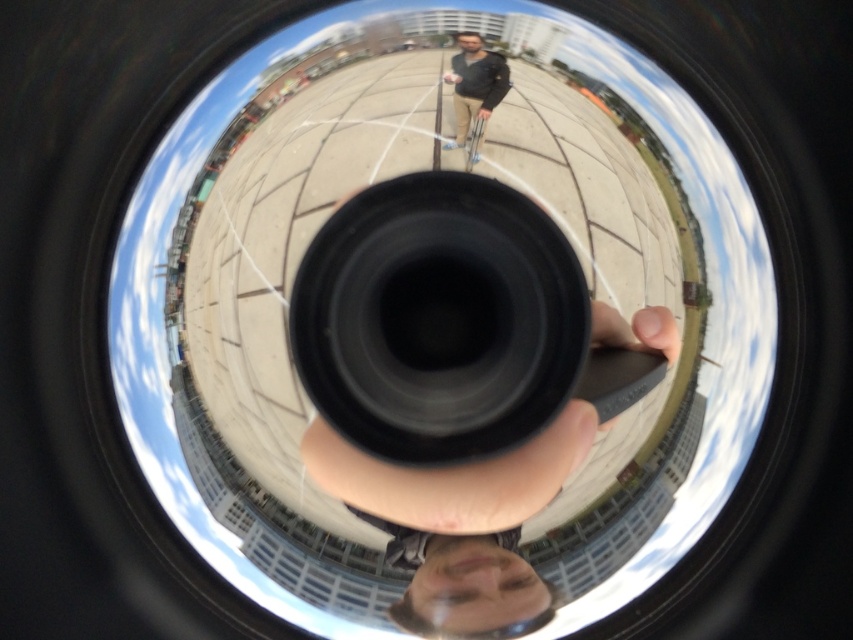
You are a photographer trying to capture a closeup of the black matte hand at center and the dark gray jacket at center in the fisheye lens image. Based on their sizes, which object should you focus on first to ensure it appears sharp in the final photo?

The black matte hand at center has a larger width than the dark gray jacket at center, so you should focus on the black matte hand at center first to ensure it appears sharp in the final photo.

Based on the scene described, which object, the black matte hand at center or the dark gray jacket at center, appears larger in the image?

The black matte hand at center appears larger because it is described as much taller than the dark gray jacket at center.